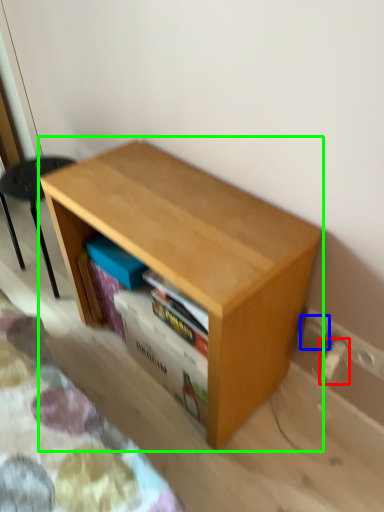
Question: Which object is the farthest from electric outlet (highlighted by a red box)? Choose among these: electric outlet (highlighted by a blue box) or table (highlighted by a green box).

Choices:
 (A) electric outlet
 (B) table

Answer: (B)